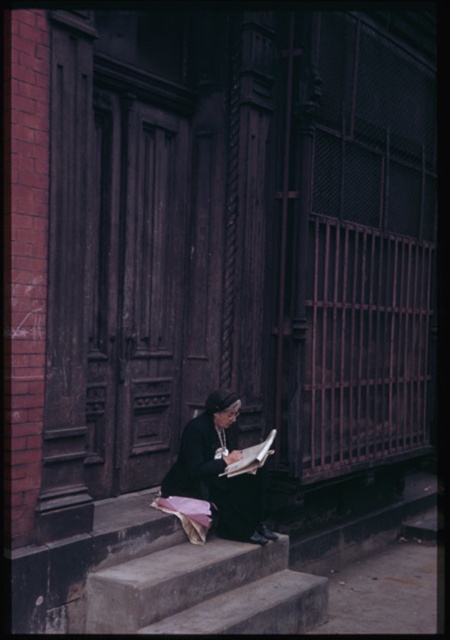
Question: Can you confirm if concrete stairs at lower center is positioned above black matte robe at lower center?

Choices:
 (A) yes
 (B) no

Answer: (B)

Question: Which point is closer to the camera?

Choices:
 (A) black matte robe at lower center
 (B) concrete stairs at lower center

Answer: (B)

Question: Among these objects, which one is farthest from the camera?

Choices:
 (A) concrete stairs at lower center
 (B) black matte robe at lower center

Answer: (B)

Question: Is concrete stairs at lower center smaller than black matte robe at lower center?

Choices:
 (A) no
 (B) yes

Answer: (A)

Question: Is the position of concrete stairs at lower center more distant than that of black matte robe at lower center?

Choices:
 (A) no
 (B) yes

Answer: (A)

Question: Which point is closer to the camera?

Choices:
 (A) concrete stairs at lower center
 (B) black matte robe at lower center

Answer: (A)